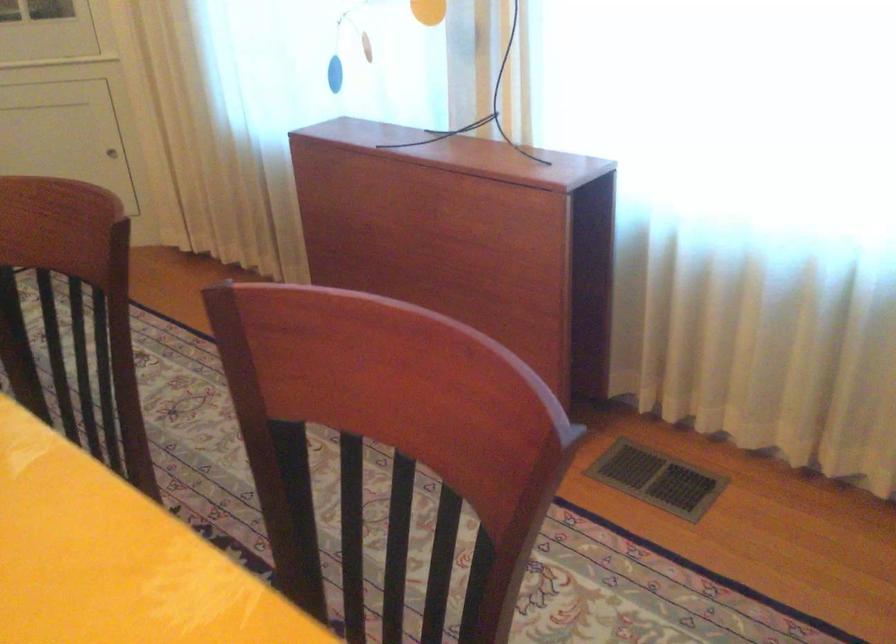
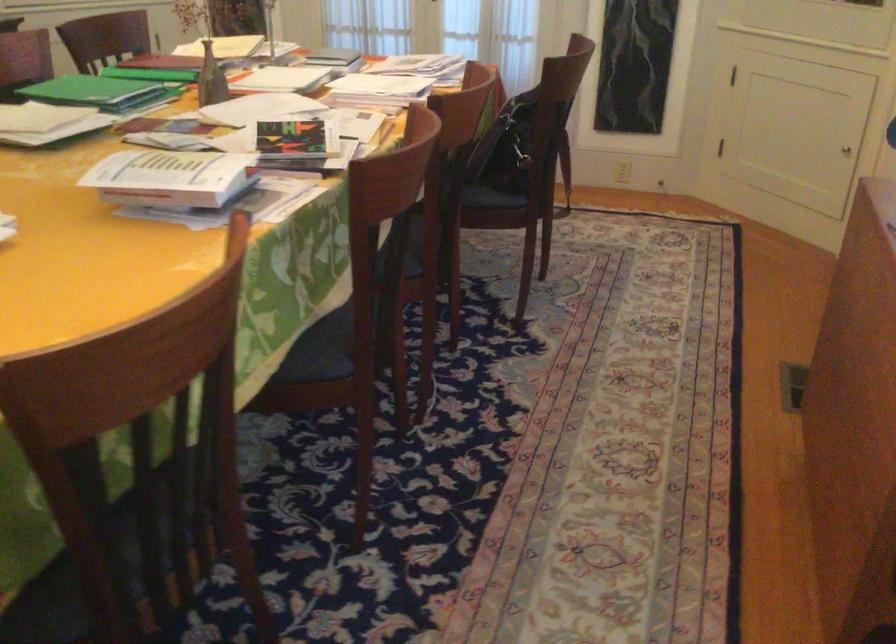
First-person continuous shooting, in which direction is the camera rotating?

The rotation direction of the camera is left-down.